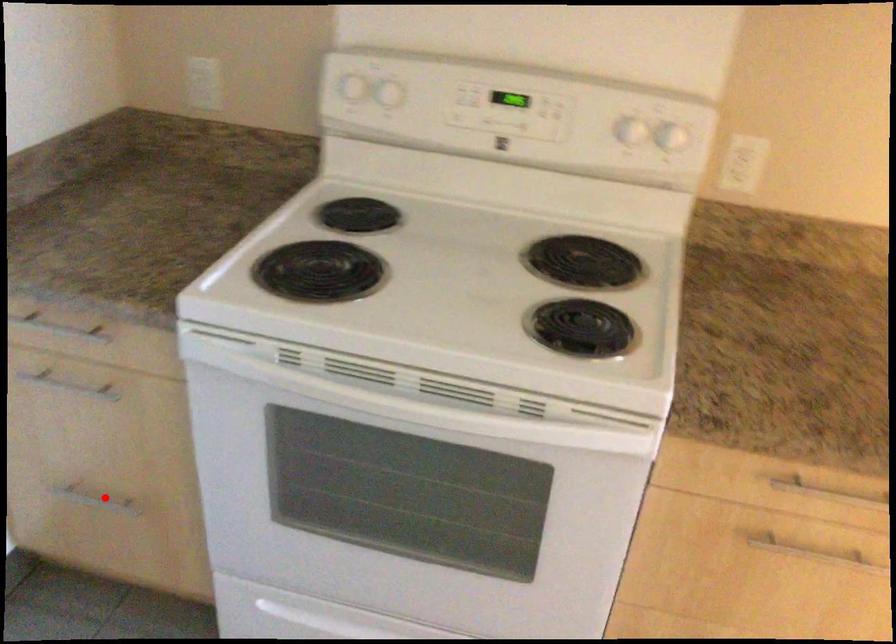
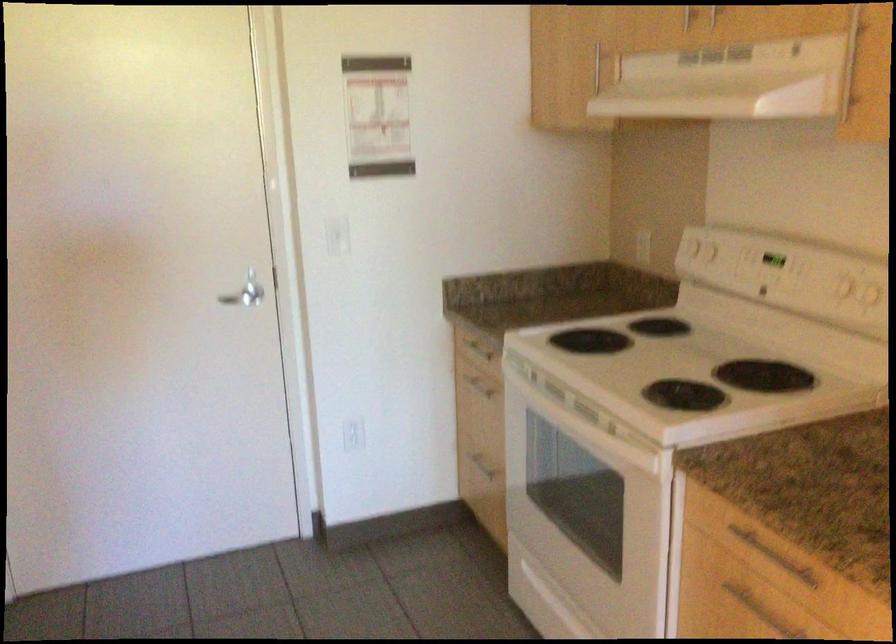
The point at the highlighted location is marked in the first image. Where is the corresponding point in the second image?

(478, 462)